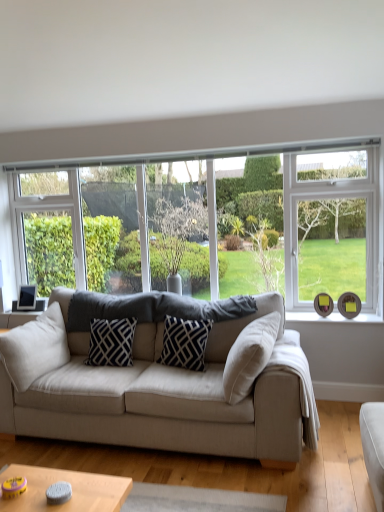
Question: From a real-world perspective, is beige fabric pillow at left, which is counted as the first pillow, starting from the left, under black and white patterned pillow at center, arranged as the second pillow when viewed from the right?

Choices:
 (A) no
 (B) yes

Answer: (A)

Question: Is beige fabric pillow at left, which is the 3th pillow from right to left, looking in the opposite direction of black and white patterned pillow at center, arranged as the second pillow when viewed from the right?

Choices:
 (A) no
 (B) yes

Answer: (A)

Question: Considering the relative sizes of beige fabric pillow at left, which is counted as the first pillow, starting from the left, and black and white patterned pillow at center, arranged as the second pillow when viewed from the right, in the image provided, is beige fabric pillow at left, which is counted as the first pillow, starting from the left, wider than black and white patterned pillow at center, arranged as the second pillow when viewed from the right,?

Choices:
 (A) yes
 (B) no

Answer: (B)

Question: Are beige fabric pillow at left, which is the 3th pillow from right to left, and black and white patterned pillow at center, arranged as the second pillow when viewed from the right, located far from each other?

Choices:
 (A) no
 (B) yes

Answer: (A)

Question: Considering the relative positions of beige fabric pillow at left, which is counted as the first pillow, starting from the left, and black and white patterned pillow at center, acting as the 2th pillow starting from the left, in the image provided, is beige fabric pillow at left, which is counted as the first pillow, starting from the left, behind black and white patterned pillow at center, acting as the 2th pillow starting from the left,?

Choices:
 (A) no
 (B) yes

Answer: (A)

Question: From a real-world perspective, relative to green leafy tree at center, is navy blue fabric pillow at center, the 3th pillow in the left-to-right sequence, vertically above or below?

Choices:
 (A) above
 (B) below

Answer: (B)

Question: Based on their sizes in the image, would you say navy blue fabric pillow at center, the first pillow positioned from the right, is bigger or smaller than green leafy tree at center?

Choices:
 (A) small
 (B) big

Answer: (A)

Question: From the image's perspective, is navy blue fabric pillow at center, the 3th pillow in the left-to-right sequence, above or below green leafy tree at center?

Choices:
 (A) above
 (B) below

Answer: (B)

Question: Is navy blue fabric pillow at center, the first pillow positioned from the right, in front of or behind green leafy tree at center in the image?

Choices:
 (A) front
 (B) behind

Answer: (A)

Question: Considering the positions of point (115, 195) and point (11, 357), is point (115, 195) closer or farther from the camera than point (11, 357)?

Choices:
 (A) farther
 (B) closer

Answer: (A)

Question: In the image, is clear glass window at center positioned in front of or behind beige fabric pillow at left, which is counted as the first pillow, starting from the left?

Choices:
 (A) front
 (B) behind

Answer: (B)

Question: Is clear glass window at center to the left or to the right of beige fabric pillow at left, which is the 3th pillow from right to left, in the image?

Choices:
 (A) left
 (B) right

Answer: (B)

Question: Is clear glass window at center inside or outside of beige fabric pillow at left, which is the 3th pillow from right to left?

Choices:
 (A) inside
 (B) outside

Answer: (B)

Question: Considering the positions of clear glass window at center and navy blue fabric pillow at center, the first pillow positioned from the right, in the image, is clear glass window at center wider or thinner than navy blue fabric pillow at center, the first pillow positioned from the right,?

Choices:
 (A) thin
 (B) wide

Answer: (A)

Question: From the image's perspective, is clear glass window at center located above or below navy blue fabric pillow at center, the 3th pillow in the left-to-right sequence?

Choices:
 (A) below
 (B) above

Answer: (B)